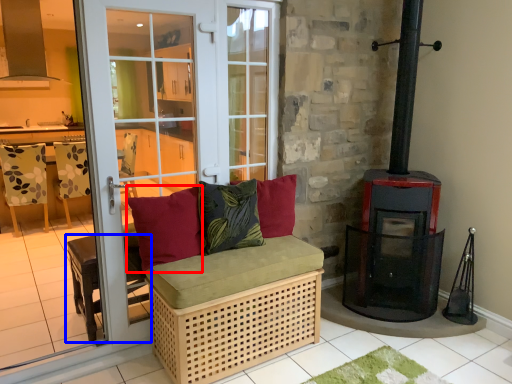
Question: Which point is further to the camera, pillow (highlighted by a red box) or furniture (highlighted by a blue box)?

Choices:
 (A) pillow
 (B) furniture

Answer: (B)